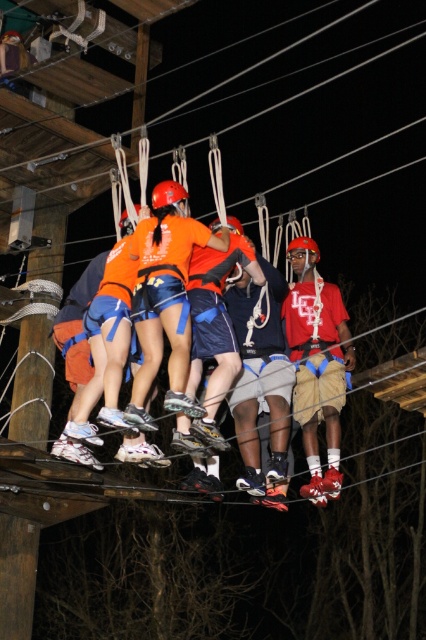
Consider the image. Does orange fabric shirt at center lie behind orange fabric helmet at center?

That is False.

The image size is (426, 640). In order to click on orange fabric shirt at center in this screenshot , I will do point(229,312).

Does red matte shirt at center have a lesser height compared to orange fabric helmet at center?

No, red matte shirt at center is not shorter than orange fabric helmet at center.

Does red matte shirt at center have a larger size compared to orange fabric helmet at center?

Yes, red matte shirt at center is bigger than orange fabric helmet at center.

Is point (330, 352) closer to viewer compared to point (279, 445)?

That is False.

At what (x,y) coordinates should I click in order to perform the action: click on red matte shirt at center. Please return your answer as a coordinate pair (x, y). The image size is (426, 640). Looking at the image, I should click on (316, 364).

How much distance is there between orange fabric shirt at center and red matte shirt at center?

orange fabric shirt at center and red matte shirt at center are 38.55 inches apart from each other.

Is orange fabric shirt at center positioned at the back of red matte shirt at center?

No, it is in front of red matte shirt at center.

What are the coordinates of `orange fabric shirt at center` in the screenshot? It's located at (229, 312).